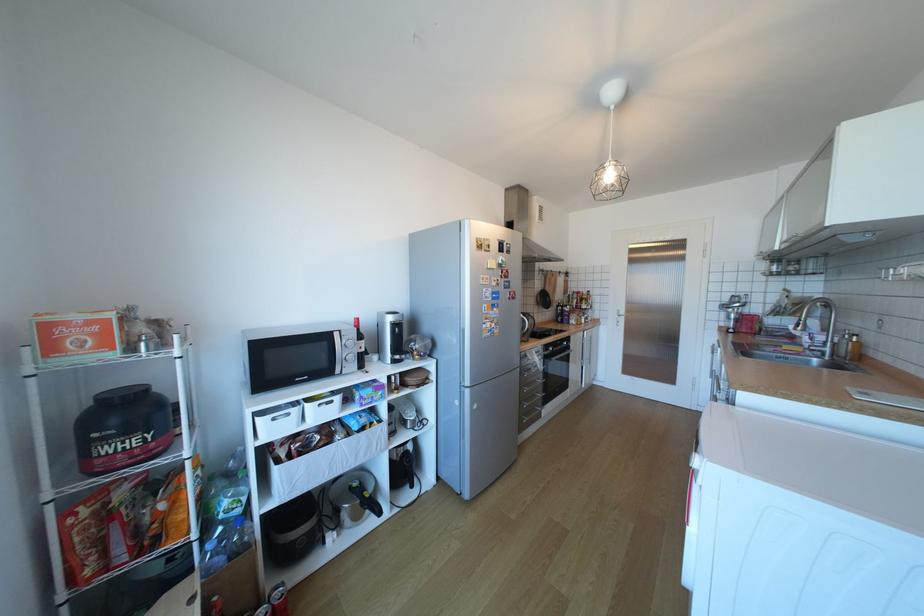
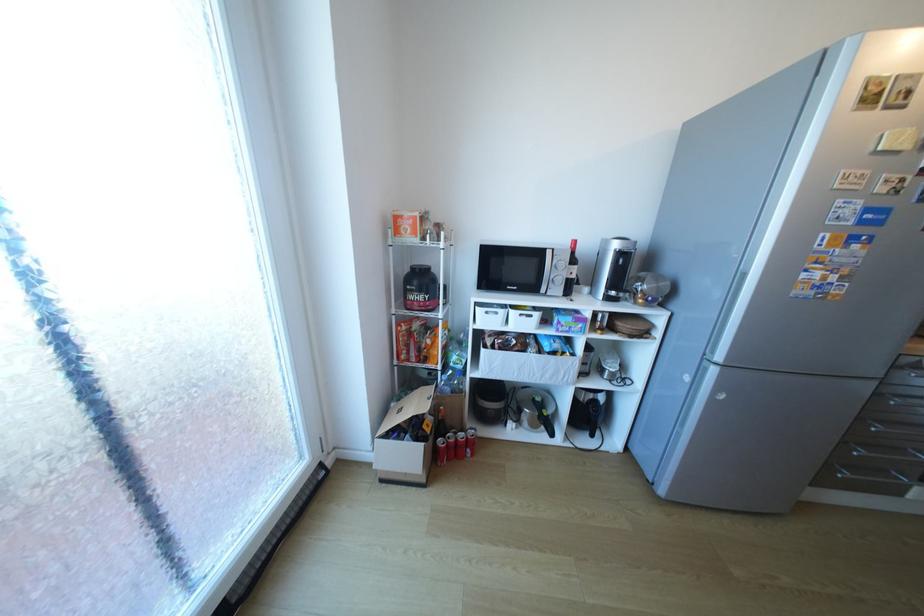
In the second image, find the point that corresponds to point (283, 419) in the first image.

(495, 313)